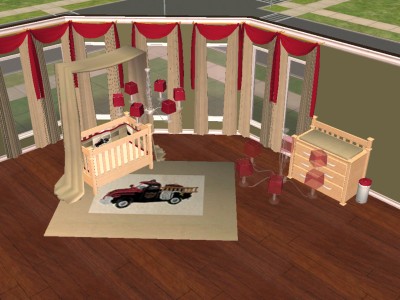
I want to click on slats on crib, so click(97, 163), click(103, 162), click(110, 160), click(115, 158), click(121, 154), click(127, 151), click(134, 150), click(138, 149), click(144, 148).